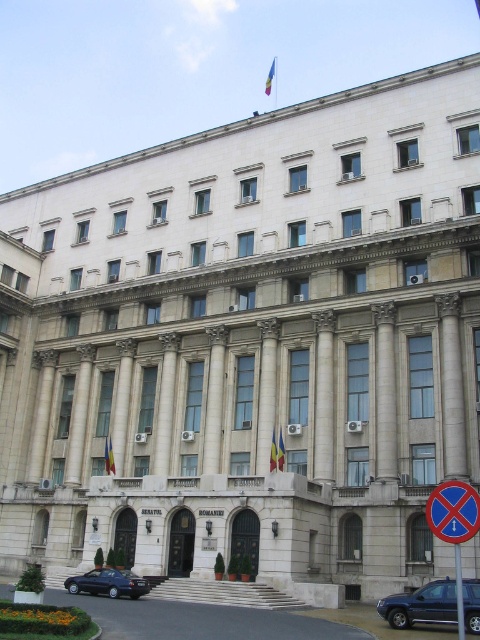
What do you see at coordinates (420, 605) in the screenshot? The image size is (480, 640). I see `metallic blue suv at lower right` at bounding box center [420, 605].

Between point (422, 612) and point (469, 492), which one is positioned behind?

The point (422, 612) is more distant.

Where is `metallic blue suv at lower right`? metallic blue suv at lower right is located at coordinates (420, 605).

Which is more to the right, metallic blue suv at lower right or blue fabric flag at center?

metallic blue suv at lower right is more to the right.

Which is in front, point (411, 612) or point (273, 433)?

Point (411, 612) is in front.

Locate an element on the screen. This screenshot has height=640, width=480. metallic blue suv at lower right is located at coordinates (420, 605).

Find the location of a particular element. This screenshot has height=640, width=480. metallic blue suv at lower right is located at coordinates (420, 605).

Is blue plastic sign at lower right above polychrome fabric flag at upper center?

Actually, blue plastic sign at lower right is below polychrome fabric flag at upper center.

Does blue plastic sign at lower right have a greater width compared to polychrome fabric flag at upper center?

Correct, the width of blue plastic sign at lower right exceeds that of polychrome fabric flag at upper center.

Where is `blue plastic sign at lower right`? The width and height of the screenshot is (480, 640). blue plastic sign at lower right is located at coordinates tap(454, 525).